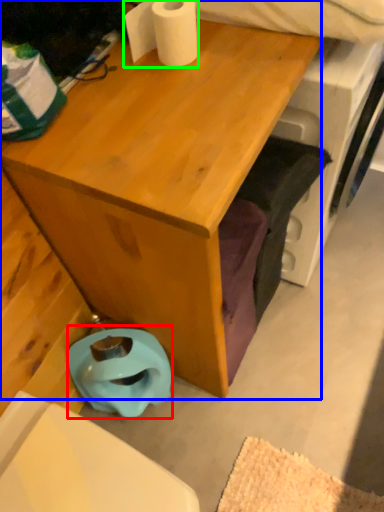
Question: Which object is positioned farthest from toilet bowl (highlighted by a red box)? Select from desk (highlighted by a blue box) and toilet paper (highlighted by a green box).

Choices:
 (A) desk
 (B) toilet paper

Answer: (B)